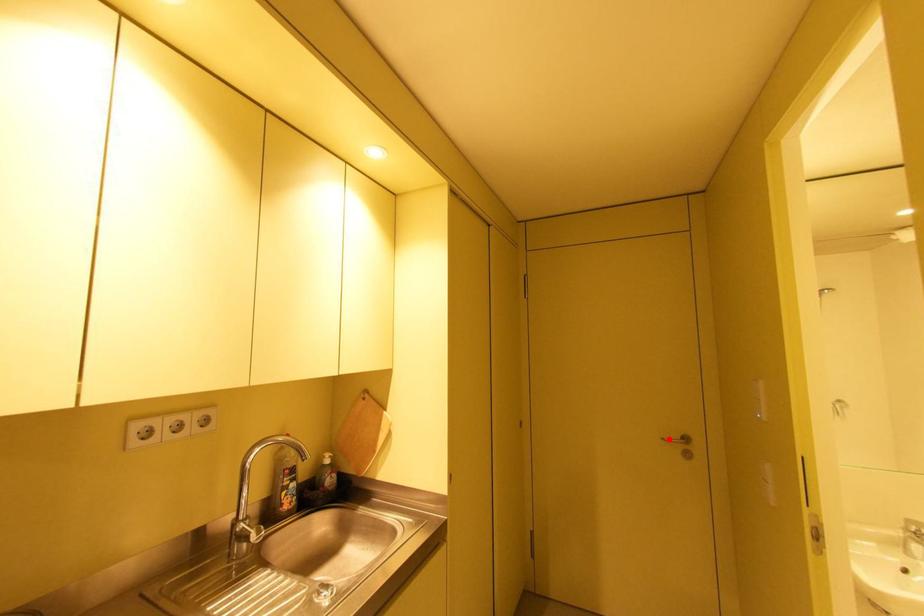
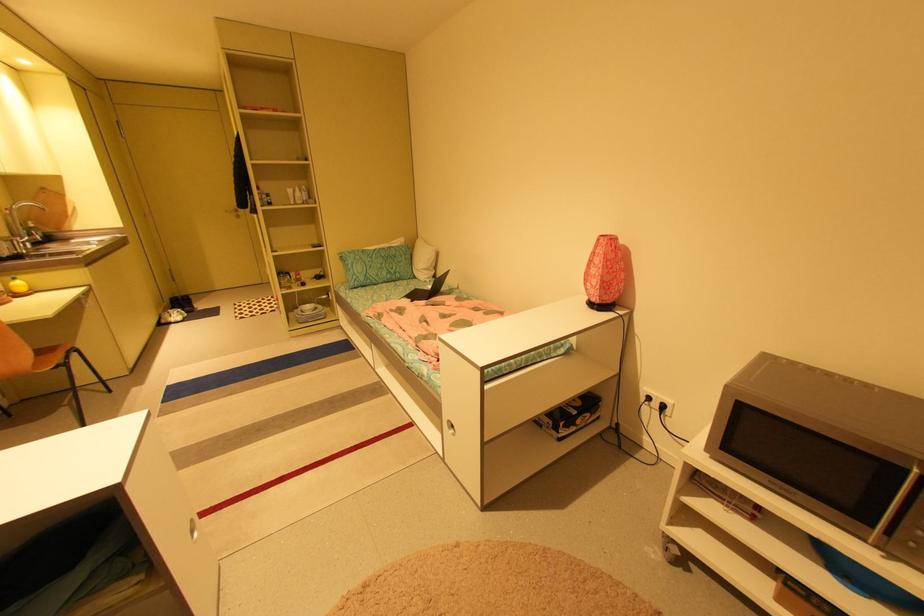
Find the pixel in the second image that matches the highlighted location in the first image.

(232, 211)